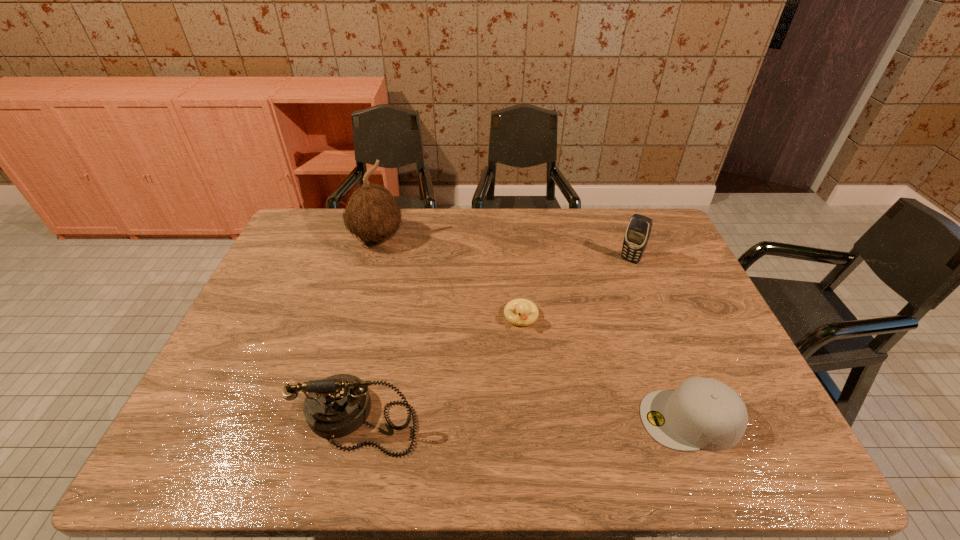
Image resolution: width=960 pixels, height=540 pixels. I want to click on free region located at the beak of the duckling, so click(534, 395).

I want to click on free spot located 0.090m at the beak of the duckling, so 528,359.

Locate an element on the screen. Image resolution: width=960 pixels, height=540 pixels. vacant space located 0.220m at the beak of the duckling is located at coordinates (536, 403).

Identify the location of free space located 0.200m on the surface of the tallest object. (418, 287).

The image size is (960, 540). I want to click on free space located 0.200m on the surface of the tallest object, so point(418,287).

The image size is (960, 540). I want to click on blank area located 0.140m on the surface of the tallest object, so click(409, 276).

Find the location of a particular element. The height and width of the screenshot is (540, 960). vacant space located 0.150m on the front face of the cellular telephone is located at coordinates (607, 291).

Find the location of a particular element. free location located on the front face of the cellular telephone is located at coordinates (600, 300).

At what (x,y) coordinates should I click in order to perform the action: click on blank space located 0.190m on the front face of the cellular telephone. Please return your answer as a coordinate pair (x, y). The image size is (960, 540). Looking at the image, I should click on (602, 299).

Where is `object that is at the far edge`? The width and height of the screenshot is (960, 540). object that is at the far edge is located at coordinates (371, 213).